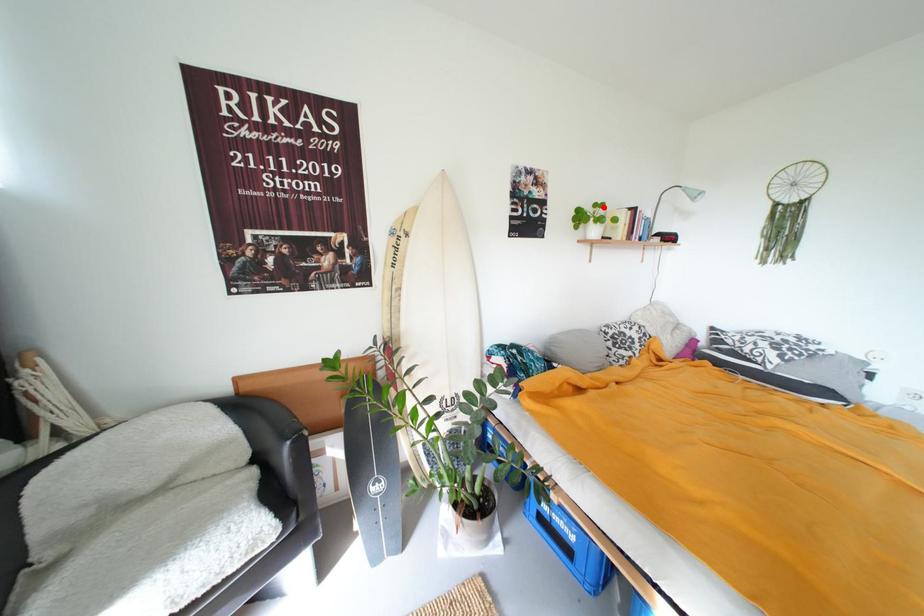
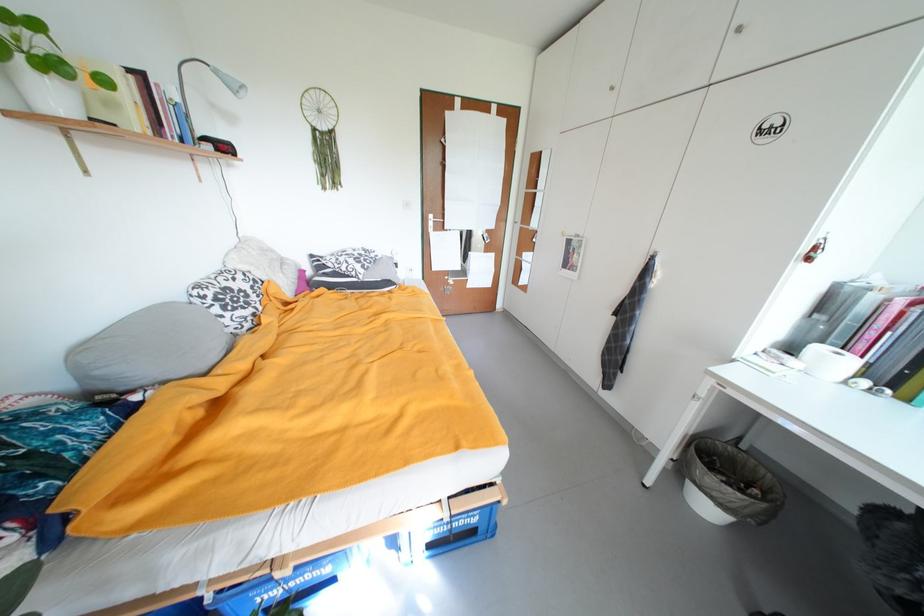
The point at the highlighted location is marked in the first image. Where is the corresponding point in the second image?

(15, 18)